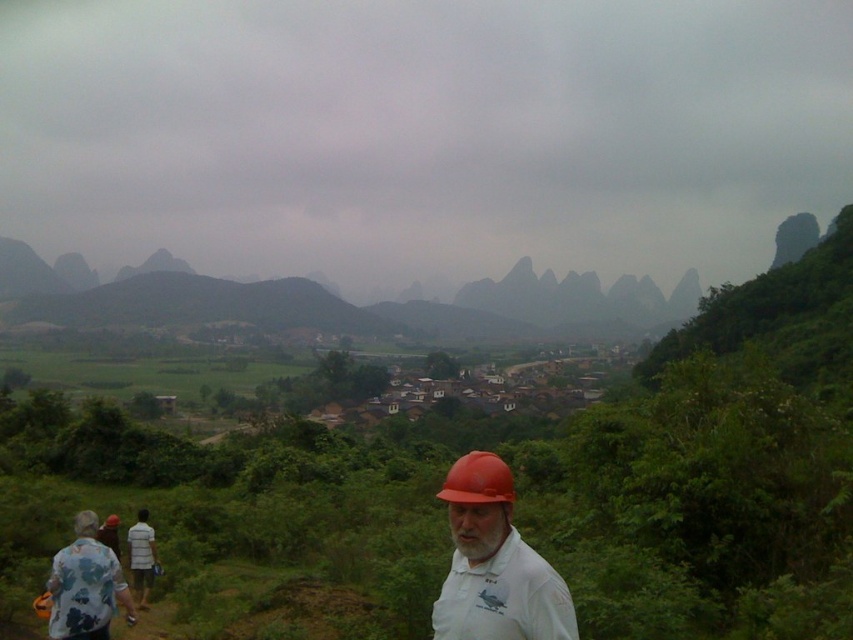
Question: Which object is positioned farthest from the matte orange hard hat at center?

Choices:
 (A) green matte mountains at upper center
 (B) matte orange hard hat at lower center
 (C) white cotton shirt at lower left

Answer: (A)

Question: Does green matte mountains at upper center have a smaller size compared to matte orange hard hat at lower center?

Choices:
 (A) no
 (B) yes

Answer: (A)

Question: Does matte orange hard hat at center appear on the left side of white cotton shirt at lower left?

Choices:
 (A) no
 (B) yes

Answer: (A)

Question: Which point is farther to the camera?

Choices:
 (A) green matte mountains at upper center
 (B) matte orange hard hat at center
 (C) white cotton shirt at lower left
 (D) matte orange hard hat at lower center

Answer: (A)

Question: Does matte orange hard hat at lower center have a greater width compared to white cotton shirt at lower left?

Choices:
 (A) yes
 (B) no

Answer: (A)

Question: Which object is the closest to the matte orange hard hat at center?

Choices:
 (A) green matte mountains at upper center
 (B) white cotton shirt at lower left
 (C) matte orange hard hat at lower center

Answer: (C)